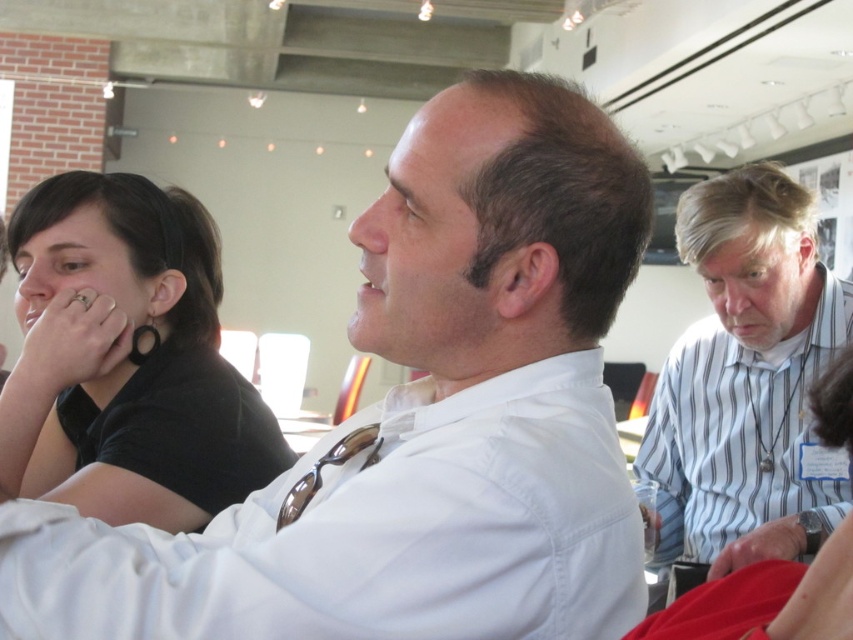
Question: Among these points, which one is farthest from the camera?

Choices:
 (A) (363, 616)
 (B) (790, 179)

Answer: (B)

Question: Which of these objects is positioned farthest from the white shirt at center?

Choices:
 (A) black matte shirt at left
 (B) white striped shirt at right

Answer: (B)

Question: Does white shirt at center lie behind black matte shirt at left?

Choices:
 (A) yes
 (B) no

Answer: (B)

Question: Is white shirt at center bigger than white striped shirt at right?

Choices:
 (A) yes
 (B) no

Answer: (B)

Question: Considering the relative positions of white shirt at center and white striped shirt at right in the image provided, where is white shirt at center located with respect to white striped shirt at right?

Choices:
 (A) right
 (B) left

Answer: (B)

Question: Estimate the real-world distances between objects in this image. Which object is closer to the black matte shirt at left?

Choices:
 (A) white shirt at center
 (B) white striped shirt at right

Answer: (A)